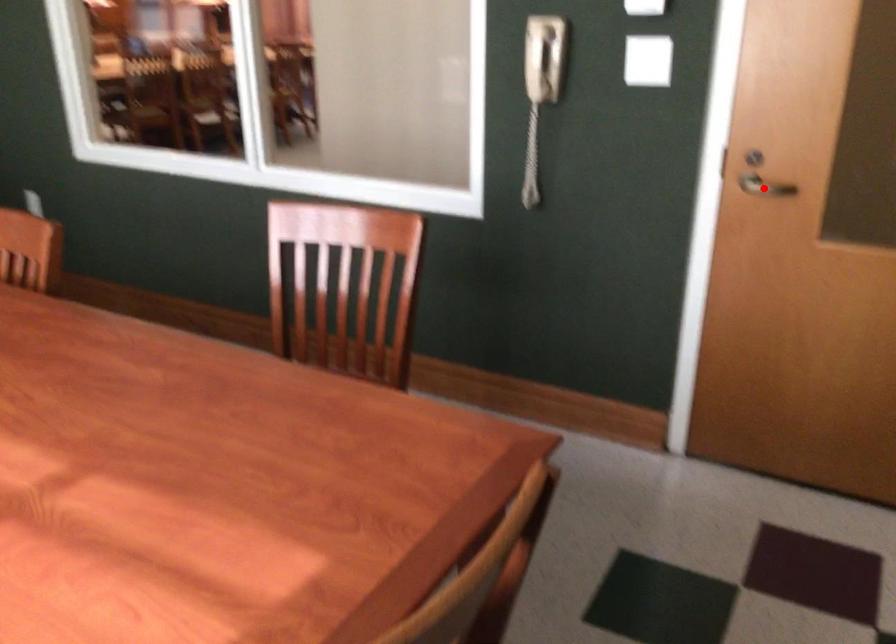
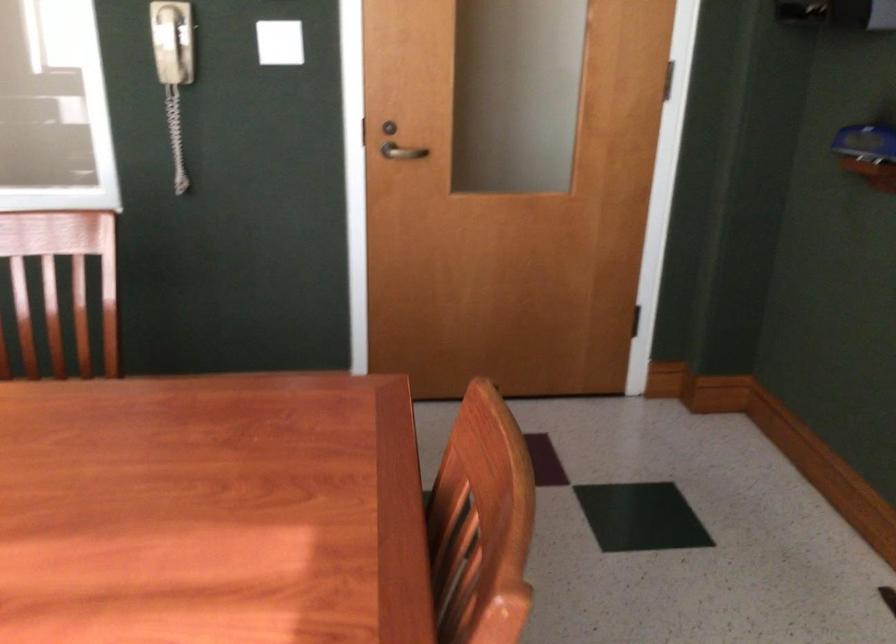
Question: I am providing you with two images of the same scene from different viewpoints. In image1, a red point is highlighted. Considering the same 3D point in image2, which of the following is correct?

Choices:
 (A) It is closer
 (B) It is farther

Answer: (B)